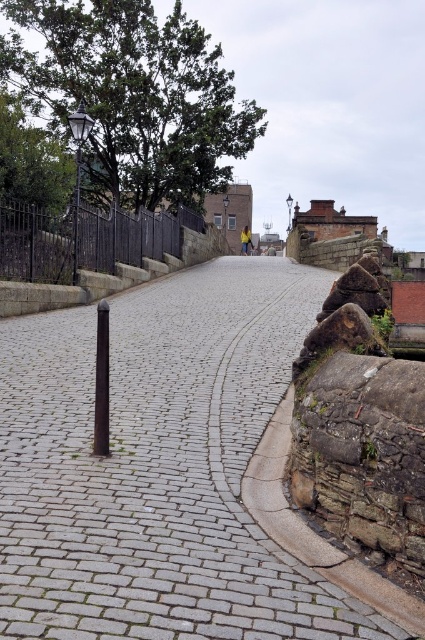
Question: Which point is closer to the camera?

Choices:
 (A) click(104, 419)
 (B) click(91, 237)
 (C) click(150, 109)

Answer: (A)

Question: Estimate the real-world distances between objects in this image. Which object is farther from the black wrought iron fence at upper left?

Choices:
 (A) gray cobblestone pavement at center
 (B) black polished pole at center

Answer: (B)

Question: Which object is positioned farthest from the black polished pole at center?

Choices:
 (A) gray cobblestone pavement at center
 (B) green leafy tree at upper left
 (C) black wrought iron fence at upper left

Answer: (B)

Question: Can you confirm if black wrought iron fence at upper left is wider than black polished pole at center?

Choices:
 (A) yes
 (B) no

Answer: (A)

Question: Does gray cobblestone pavement at center have a smaller size compared to black polished pole at center?

Choices:
 (A) yes
 (B) no

Answer: (B)

Question: Can you confirm if green leafy tree at upper left is positioned above black wrought iron fence at upper left?

Choices:
 (A) yes
 (B) no

Answer: (A)